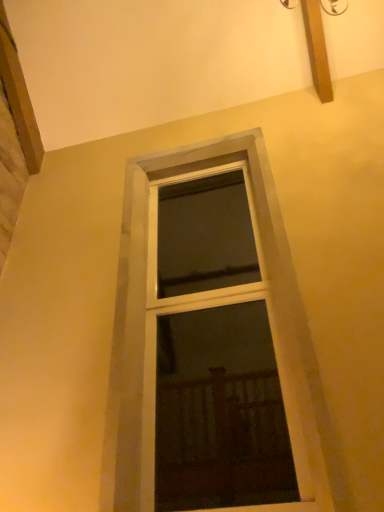
Question: Should I look upward or downward to see white wood window at center?

Choices:
 (A) up
 (B) down

Answer: (B)